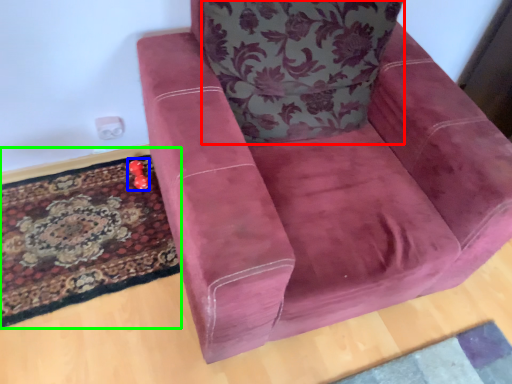
Question: Estimate the real-world distances between objects in this image. Which object is closer to throw pillow (highlighted by a red box), toy (highlighted by a blue box) or mat (highlighted by a green box)?

Choices:
 (A) toy
 (B) mat

Answer: (B)